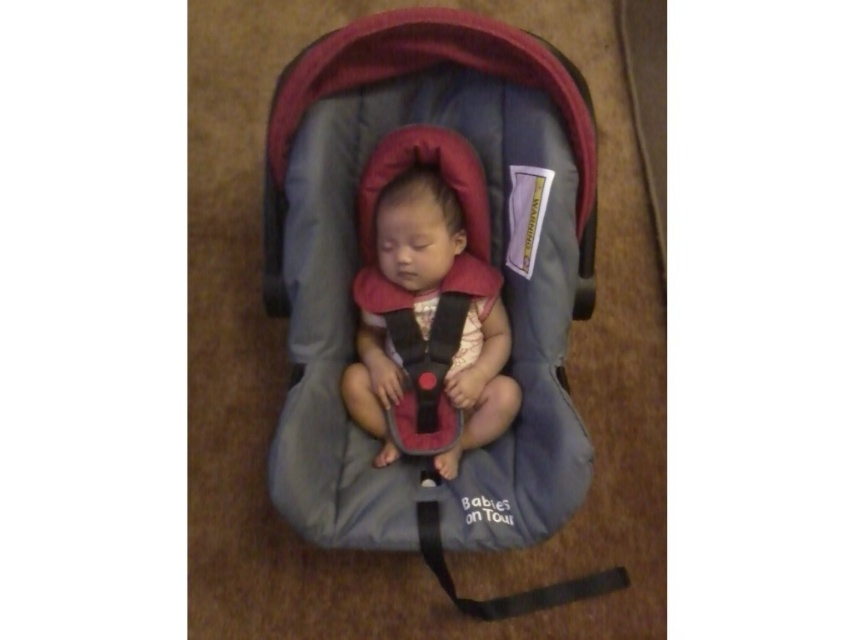
Which is below, gray fabric baby carriage at center or black fabric strap at center?

black fabric strap at center is below.

Does gray fabric baby carriage at center come in front of black fabric strap at center?

Yes, gray fabric baby carriage at center is in front of black fabric strap at center.

Who is more distant from viewer, (532, 435) or (405, 428)?

Positioned behind is point (405, 428).

Identify the location of gray fabric baby carriage at center. (442, 282).

Measure the distance between matte black baby carrier at center and black fabric strap at center.

The distance of matte black baby carrier at center from black fabric strap at center is 2.19 inches.

Can you confirm if matte black baby carrier at center is bigger than black fabric strap at center?

Yes, matte black baby carrier at center is bigger than black fabric strap at center.

Image resolution: width=853 pixels, height=640 pixels. What do you see at coordinates (418, 237) in the screenshot?
I see `matte black baby carrier at center` at bounding box center [418, 237].

The image size is (853, 640). What are the coordinates of `matte black baby carrier at center` in the screenshot? It's located at (418, 237).

Is gray fabric baby carriage at center wider than matte black baby carrier at center?

Correct, the width of gray fabric baby carriage at center exceeds that of matte black baby carrier at center.

Is gray fabric baby carriage at center thinner than matte black baby carrier at center?

No, gray fabric baby carriage at center is not thinner than matte black baby carrier at center.

Is point (334, 157) less distant than point (422, 269)?

Yes, it is.

Locate an element on the screen. This screenshot has width=853, height=640. gray fabric baby carriage at center is located at coordinates (442, 282).